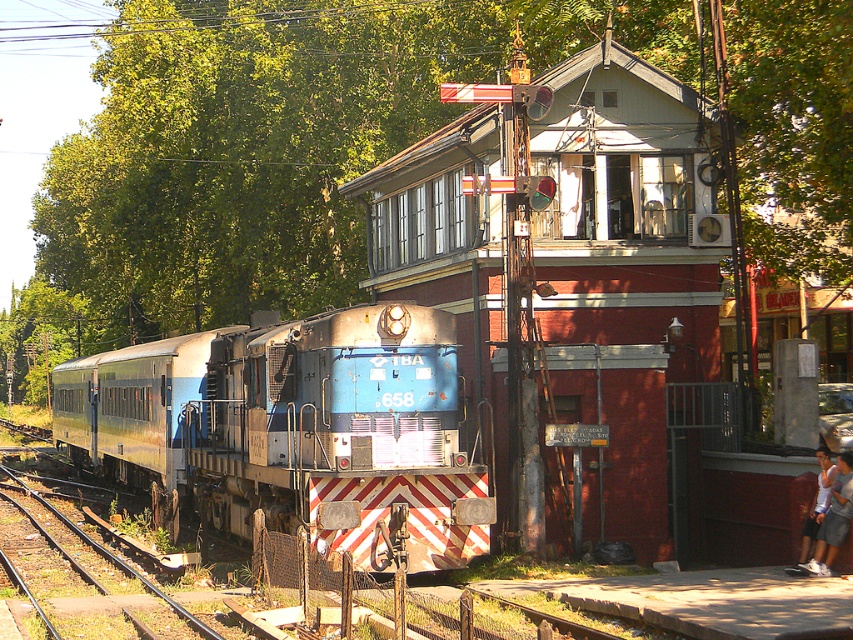
Question: Which of the following is the closest to the observer?

Choices:
 (A) (824, 481)
 (B) (276, 518)

Answer: (A)

Question: Is rusty metal train at left smaller than white cotton shirt at lower right?

Choices:
 (A) yes
 (B) no

Answer: (B)

Question: Is the position of rusty metal train at left less distant than that of white cotton shirt at lower right?

Choices:
 (A) no
 (B) yes

Answer: (A)

Question: Which of the following is the closest to the observer?

Choices:
 (A) (271, 355)
 (B) (833, 548)

Answer: (B)

Question: Can you confirm if rusty metal train at left is bigger than white cotton shirt at lower right?

Choices:
 (A) no
 (B) yes

Answer: (B)

Question: Which point is closer to the camera?

Choices:
 (A) rusty metal train at left
 (B) white cotton shirt at lower right

Answer: (B)